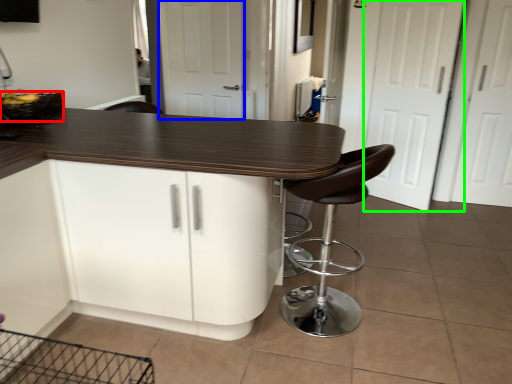
Question: Which object is positioned closest to basket (highlighted by a red box)? Select from screen door (highlighted by a blue box) and screen door (highlighted by a green box).

Choices:
 (A) screen door
 (B) screen door

Answer: (A)